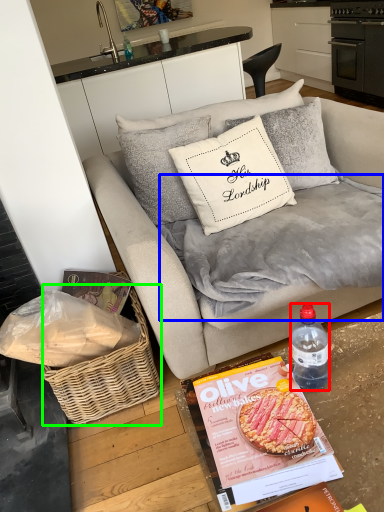
Question: Based on their relative distances, which object is farther from bottle (highlighted by a red box)? Choose from blanket (highlighted by a blue box) and picnic basket (highlighted by a green box).

Choices:
 (A) blanket
 (B) picnic basket

Answer: (B)